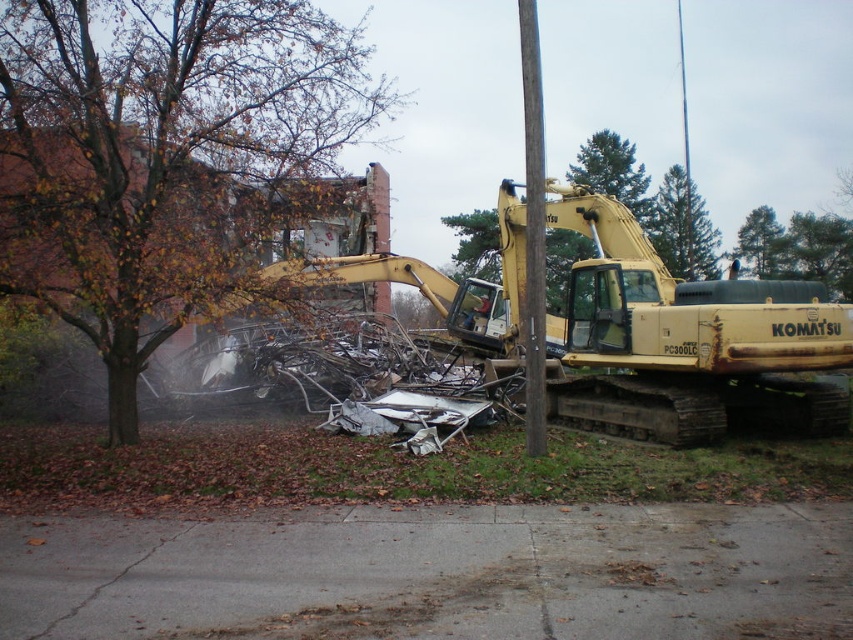
From the picture: Does gray asphalt pavement at lower center appear on the right side of brown wooden pole at center?

In fact, gray asphalt pavement at lower center is to the left of brown wooden pole at center.

Is gray asphalt pavement at lower center closer to the viewer compared to brown wooden pole at center?

Yes.

What do you see at coordinates (434, 573) in the screenshot? The width and height of the screenshot is (853, 640). I see `gray asphalt pavement at lower center` at bounding box center [434, 573].

The width and height of the screenshot is (853, 640). I want to click on gray asphalt pavement at lower center, so click(434, 573).

Can you confirm if brown wooden pole at center is shorter than green textured pine tree at upper center?

No.

Who is more distant from viewer, (532, 227) or (682, 205)?

Positioned behind is point (682, 205).

The height and width of the screenshot is (640, 853). I want to click on brown wooden pole at center, so click(532, 234).

Identify the location of brown wooden pole at center. (532, 234).

Is gray asphalt pavement at lower center below brown leafy tree at left?

Yes, gray asphalt pavement at lower center is below brown leafy tree at left.

Who is higher up, gray asphalt pavement at lower center or brown leafy tree at left?

brown leafy tree at left is higher up.

You are a GUI agent. You are given a task and a screenshot of the screen. Output one action in this format:
    pyautogui.click(x=<x>, y=<y>)
    Task: Click on the gray asphalt pavement at lower center
    The image size is (853, 640).
    Given the screenshot: What is the action you would take?
    pyautogui.click(x=434, y=573)